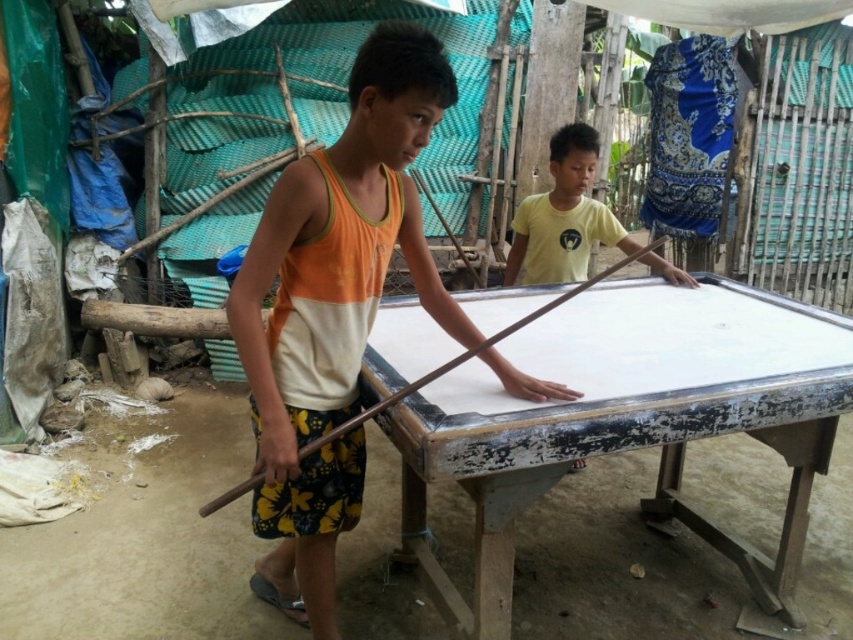
You are a photographer trying to capture the boys playing pool. You notice the orange and white tank top at center and the brown wooden stick at center in your frame. Which object appears narrower in the photo?

The orange and white tank top at center appears narrower than the brown wooden stick at center in the photo.

You are a photographer trying to capture a closeup of the orange and white tank top at center and the brown wooden stick at center in the scene. Which object should you zoom in on first to ensure it fits entirely within the frame?

The brown wooden stick at center should be zoomed in on first because it is smaller than the orange and white tank top at center, so it requires less adjustment to fit within the frame.

You are a photographer trying to capture a closeup of the orange and white tank top at center without including the white painted wood billiard table at center in the shot. Given their sizes, is this possible?

The white painted wood billiard table at center is larger in size than orange and white tank top at center, so it might be challenging to frame the orange and white tank top at center without including the table due to its larger size taking up more space in the scene.